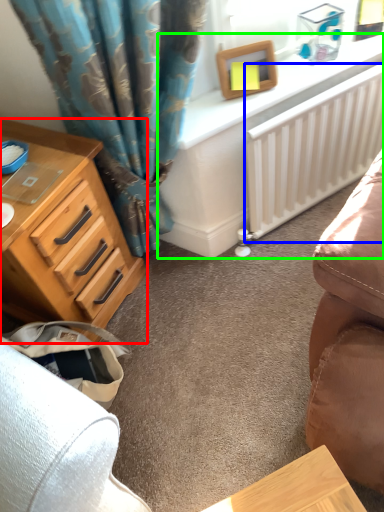
Question: Which is nearer to the chest of drawers (highlighted by a red box)? radiator (highlighted by a blue box) or computer desk (highlighted by a green box).

Choices:
 (A) radiator
 (B) computer desk

Answer: (B)